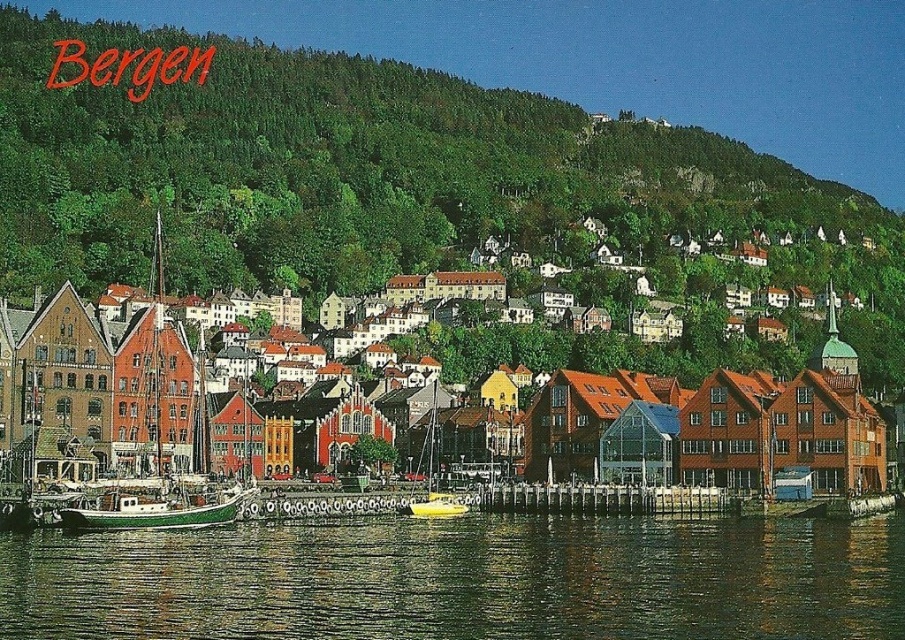
You are standing at the waterfront in Bergen, Norway, looking at the scene described. There are two points marked in the image, point 1 at coordinates point [375,580] and point 2 at coordinates point [807,416]. Which point is closer to you?

Point [375,580] is closer to the viewer than point [807,416].

You are a tourist standing on the pier in Bergen, Norway. You see the brown wooden buildings at center and the yellow matte sailboat at center. Which object is located to the right of the other?

The brown wooden buildings at center is positioned on the right side of yellow matte sailboat at center, so the brown wooden buildings at center are to the right of the yellow matte sailboat at center.

You are standing at the waterfront in Bergen, Norway, looking out towards the green reflective water at lower center and the brown wooden buildings at center. Which of these two objects is closer to you?

The green reflective water at lower center is closer to you because it is positioned in front of the brown wooden buildings at center.